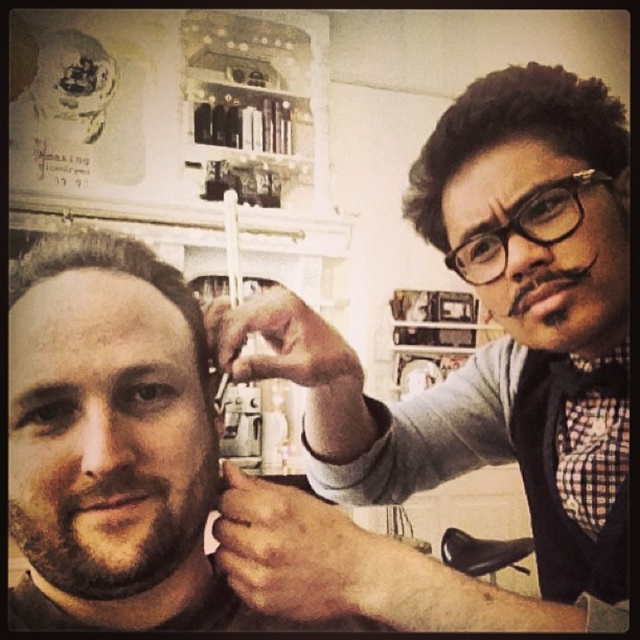
You are a customer in the barbershop and want to see your barber who is cutting your hair. Can you see the brown matte hair at center through the brownroughbeard at left?

The brownroughbeard at left is in front of brown matte hair at center, so you cannot see the brown matte hair at center through the brownroughbeard at left.

You are a customer in a barbershop and you want to know if the black matte comb at upper right can reach the brown matte hair at center without moving the comb. The comb is 12 inches long. Can it reach?

The distance between the black matte comb at upper right and the brown matte hair at center is 13.34 inches. Since the comb is only 12 inches long, it cannot reach the hair without moving the comb.

You are a customer in a barbershop and want to know if your hair and the barber can be within 12 inches of each other during a haircut. Based on the scene, can the black textured hair at upper right and the brown matte hair at center be within this distance?

The distance between the black textured hair at upper right and the brown matte hair at center is 14.45 inches, which is more than 12 inches. Therefore, they cannot be within the desired 12 inches during the haircut.